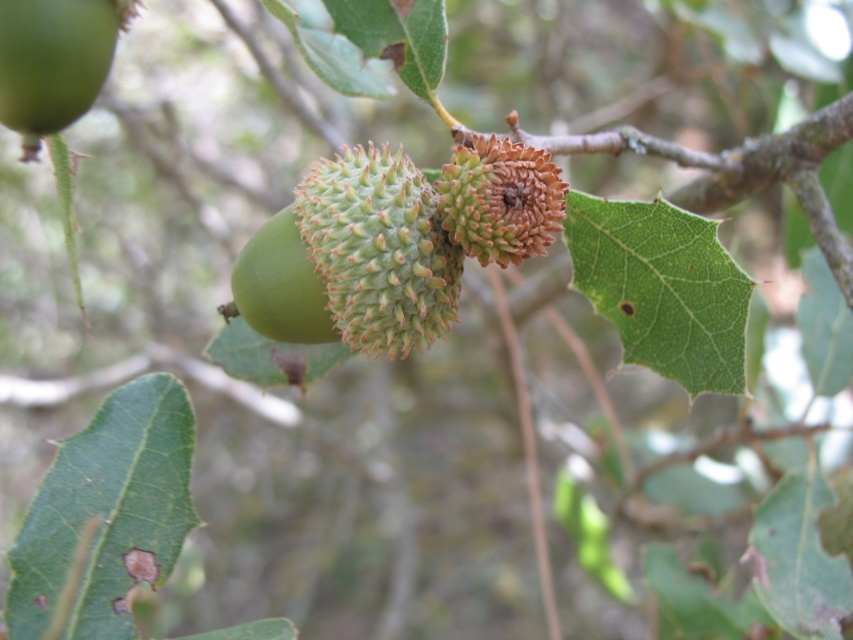
Question: Observing the image, what is the correct spatial positioning of brown spiky acorn at center in reference to green matte acorn at center?

Choices:
 (A) above
 (B) below

Answer: (A)

Question: Which object is farther from the camera taking this photo?

Choices:
 (A) green spiky acorn at center
 (B) green matte acorn at upper left
 (C) green matte acorn at center
 (D) brown spiky acorn at center

Answer: (C)

Question: Which object is the farthest from the green spiky acorn at center?

Choices:
 (A) green matte acorn at upper left
 (B) brown spiky acorn at center
 (C) green matte acorn at center

Answer: (A)

Question: From the image, what is the correct spatial relationship of green matte acorn at upper left in relation to brown spiky acorn at center?

Choices:
 (A) left
 (B) right

Answer: (A)

Question: Can you confirm if green spiky acorn at center is thinner than green matte acorn at center?

Choices:
 (A) yes
 (B) no

Answer: (B)

Question: Which point is closer to the camera?

Choices:
 (A) (532, 177)
 (B) (308, 273)
 (C) (39, 115)

Answer: (C)